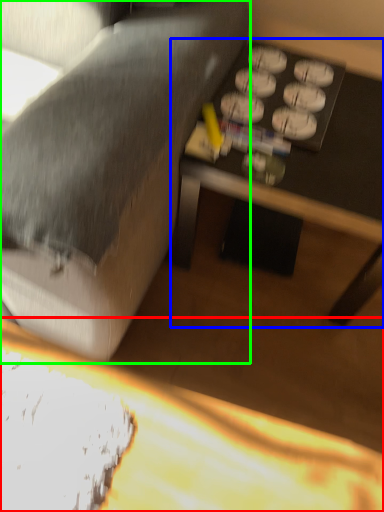
Question: Considering the real-world distances, which object is closest to table (highlighted by a red box)? table (highlighted by a blue box) or studio couch (highlighted by a green box).

Choices:
 (A) table
 (B) studio couch

Answer: (B)